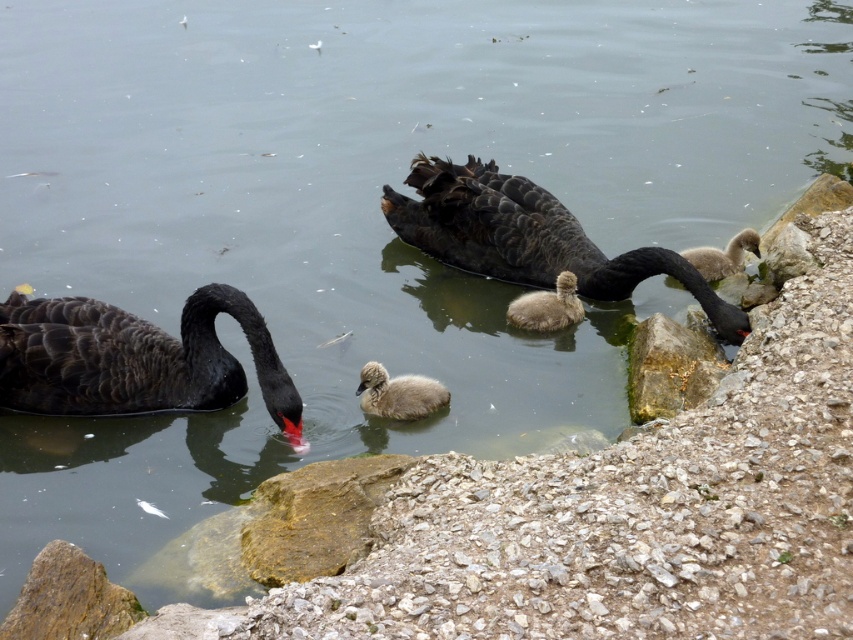
Does matte black swan at left appear on the left side of brown downy duckling at center?

Indeed, matte black swan at left is positioned on the left side of brown downy duckling at center.

Can you confirm if matte black swan at left is positioned to the right of brown downy duckling at center?

Incorrect, matte black swan at left is not on the right side of brown downy duckling at center.

The image size is (853, 640). What do you see at coordinates (135, 358) in the screenshot? I see `matte black swan at left` at bounding box center [135, 358].

The height and width of the screenshot is (640, 853). I want to click on matte black swan at left, so click(135, 358).

Locate an element on the screen. The image size is (853, 640). brown downy duckling at center is located at coordinates (398, 394).

Looking at this image, which is below, brown downy duckling at center or soft gray downy duckling at center?

brown downy duckling at center

Who is more distant from viewer, (364,371) or (508,321)?

The point (508,321) is more distant.

Locate an element on the screen. This screenshot has height=640, width=853. brown downy duckling at center is located at coordinates (398, 394).

How much distance is there between matte black swan at left and black glossy swan at center?

matte black swan at left and black glossy swan at center are 1.57 meters apart.

Is matte black swan at left taller than black glossy swan at center?

No.

Who is more forward, (x=271, y=412) or (x=699, y=304)?

Positioned in front is point (x=271, y=412).

At what (x,y) coordinates should I click in order to perform the action: click on matte black swan at left. Please return your answer as a coordinate pair (x, y). The image size is (853, 640). Looking at the image, I should click on (135, 358).